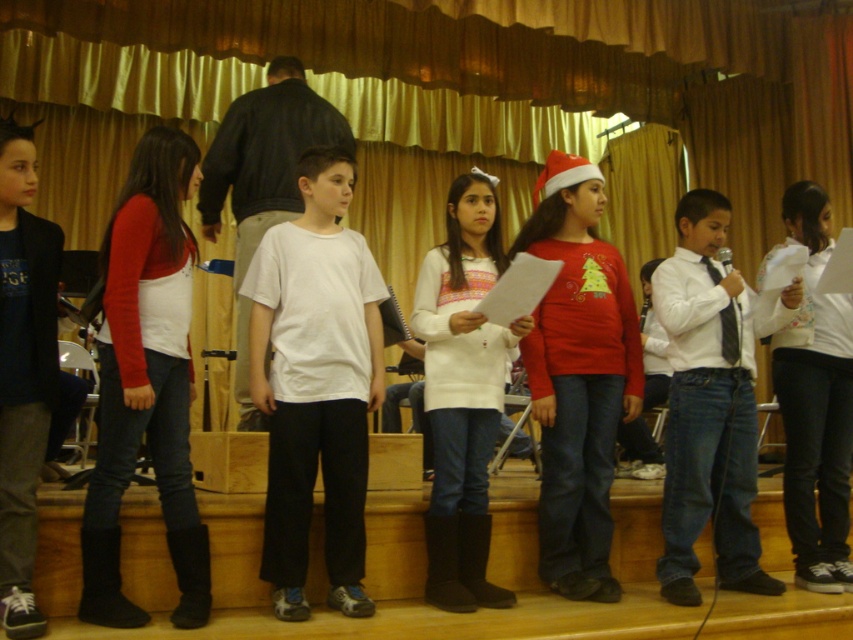
Question: Which of these objects is positioned farthest from the matte white vest at center?

Choices:
 (A) white sweater at center
 (B) dark gray pants at center
 (C) white floral shirt at center
 (D) white cotton t-shirt at center

Answer: (C)

Question: Where is white cotton t-shirt at center located in relation to dark gray pants at center in the image?

Choices:
 (A) left
 (B) right

Answer: (B)

Question: Is white cotton t-shirt at center positioned in front of matte white vest at center?

Choices:
 (A) no
 (B) yes

Answer: (A)

Question: Which of the following is the farthest from the observer?

Choices:
 (A) (495, 262)
 (B) (563, 314)
 (C) (86, 577)
 (D) (283, 280)

Answer: (A)

Question: Which object appears farthest from the camera in this image?

Choices:
 (A) dark gray pants at center
 (B) matte white vest at center

Answer: (B)

Question: Does matte white vest at center have a lesser width compared to dark gray pants at center?

Choices:
 (A) no
 (B) yes

Answer: (A)